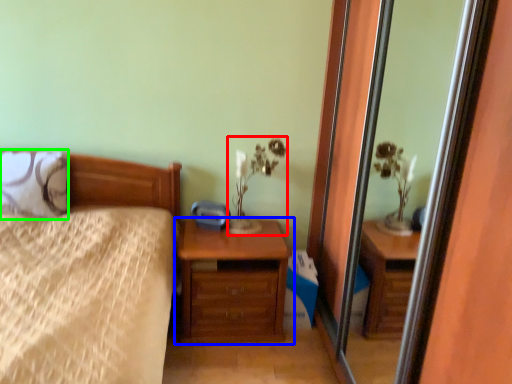
Question: Based on their relative distances, which object is nearer to table lamp (highlighted by a red box)? Choose from chest of drawers (highlighted by a blue box) and pillow (highlighted by a green box).

Choices:
 (A) chest of drawers
 (B) pillow

Answer: (A)